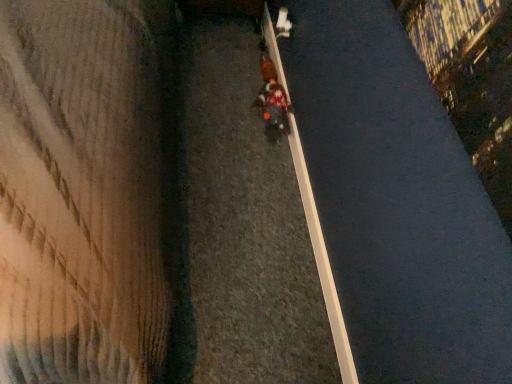
Measure the distance between white smooth curb at center and camera.

The depth of white smooth curb at center is 1.31 meters.

The width and height of the screenshot is (512, 384). Find the location of `red fabric pedestrian at center`. red fabric pedestrian at center is located at coordinates (268, 69).

Measure the distance between point (275, 109) and camera.

A distance of 2.02 meters exists between point (275, 109) and camera.

The width and height of the screenshot is (512, 384). In order to click on white smooth curb at center in this screenshot , I will do `click(322, 259)`.

Is knitted sweater at center completely or partially inside white smooth curb at center?

Actually, knitted sweater at center is outside white smooth curb at center.

From a real-world perspective, is white smooth curb at center above or below knitted sweater at center?

From a real-world perspective, white smooth curb at center is physically below knitted sweater at center.

Is knitted sweater at center at the back of white smooth curb at center?

No.

Considering the relative sizes of white smooth curb at center and knitted sweater at center in the image provided, is white smooth curb at center bigger than knitted sweater at center?

Incorrect, white smooth curb at center is not larger than knitted sweater at center.

Are knitted sweater at center and white smooth curb at center far apart?

No, knitted sweater at center is in close proximity to white smooth curb at center.

Which of these two, knitted sweater at center or white smooth curb at center, is wider?

knitted sweater at center.

Who is bigger, knitted sweater at center or white smooth curb at center?

With larger size is knitted sweater at center.

Is knitted sweater at center further to the viewer compared to white smooth curb at center?

Yes, it is.

Is white smooth curb at center oriented towards red fabric pedestrian at center?

Yes, white smooth curb at center is aimed at red fabric pedestrian at center.

Between white smooth curb at center and red fabric pedestrian at center, which one appears on the left side from the viewer's perspective?

From the viewer's perspective, red fabric pedestrian at center appears more on the left side.

In the image, is white smooth curb at center positioned in front of or behind red fabric pedestrian at center?

Visually, white smooth curb at center is located in front of red fabric pedestrian at center.

Can you confirm if knitted sweater at center is wider than red fabric pedestrian at center?

Yes, knitted sweater at center is wider than red fabric pedestrian at center.

From a real-world perspective, who is located lower, knitted sweater at center or red fabric pedestrian at center?

From a 3D spatial view, red fabric pedestrian at center is below.

Considering the points (256, 100) and (261, 72), which point is in front, point (256, 100) or point (261, 72)?

Positioned in front is point (256, 100).

From the image's perspective, between knitted sweater at center and red fabric pedestrian at center, which one is located above?

red fabric pedestrian at center is shown above in the image.

Who is taller, red fabric pedestrian at center or knitted sweater at center?

knitted sweater at center.

From the image's perspective, is red fabric pedestrian at center on top of knitted sweater at center?

Indeed, from the image's perspective, red fabric pedestrian at center is shown above knitted sweater at center.

Where is `person positioned vertically above the red fabric pedestrian at center (from a real-world perspective)`? The height and width of the screenshot is (384, 512). person positioned vertically above the red fabric pedestrian at center (from a real-world perspective) is located at coordinates (274, 106).

Which is closer, (270, 60) or (272, 122)?

Point (270, 60).

Is red fabric pedestrian at center spatially inside white smooth curb at center, or outside of it?

red fabric pedestrian at center lies outside white smooth curb at center.

Where is `pedestrian behind the white smooth curb at center`? pedestrian behind the white smooth curb at center is located at coordinates (268, 69).

Can you tell me how much red fabric pedestrian at center and white smooth curb at center differ in facing direction?

The facing directions of red fabric pedestrian at center and white smooth curb at center are 3 degrees apart.

Does red fabric pedestrian at center come behind white smooth curb at center?

Yes, red fabric pedestrian at center is further from the camera.

The image size is (512, 384). Identify the location of person that is on the left side of white smooth curb at center. (274, 106).

Locate an element on the screen. curb in front of the knitted sweater at center is located at coordinates (322, 259).

Which object lies further to the anchor point knitted sweater at center, red fabric pedestrian at center or white smooth curb at center?

Among the two, white smooth curb at center is located further to knitted sweater at center.

From the image, which object appears to be nearer to white smooth curb at center, red fabric pedestrian at center or knitted sweater at center?

knitted sweater at center is positioned closer to the anchor white smooth curb at center.

From the image, which object appears to be nearer to red fabric pedestrian at center, white smooth curb at center or knitted sweater at center?

The object closer to red fabric pedestrian at center is knitted sweater at center.

Looking at the image, which one is located further to knitted sweater at center, white smooth curb at center or red fabric pedestrian at center?

white smooth curb at center is further to knitted sweater at center.

In the scene shown: Estimate the real-world distances between objects in this image. Which object is further from red fabric pedestrian at center, knitted sweater at center or white smooth curb at center?

white smooth curb at center.

Estimate the real-world distances between objects in this image. Which object is further from white smooth curb at center, knitted sweater at center or red fabric pedestrian at center?

red fabric pedestrian at center is positioned further to the anchor white smooth curb at center.

I want to click on person between white smooth curb at center and red fabric pedestrian at center along the z-axis, so 274,106.